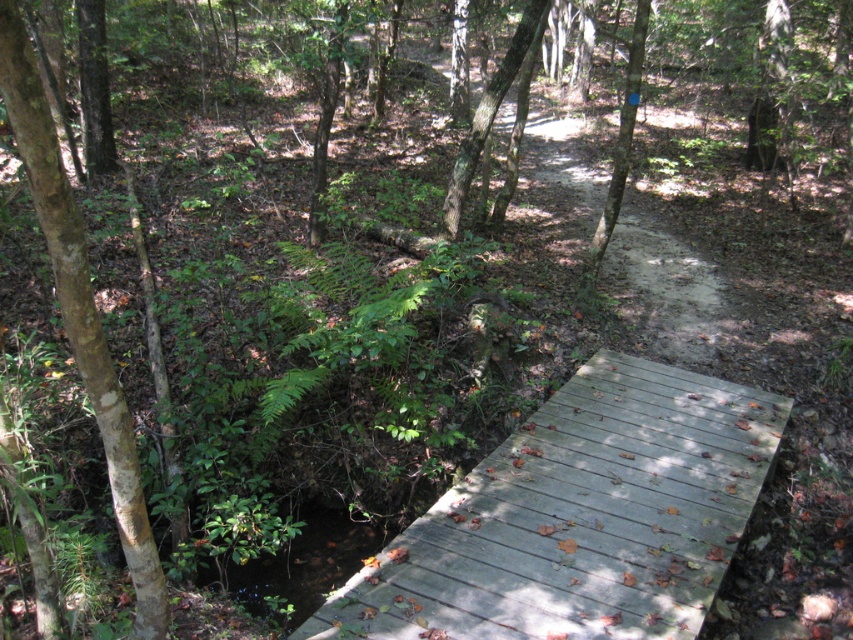
Question: Which of the following is the closest to the observer?

Choices:
 (A) (303, 625)
 (B) (106, 353)
 (C) (630, 116)
 (D) (454, 179)

Answer: (B)

Question: Is smooth brown tree trunk at center to the right of smooth bark tree at upper center from the viewer's perspective?

Choices:
 (A) no
 (B) yes

Answer: (A)

Question: Can you confirm if wooden bridge at center is positioned below brown/scaly tree trunk at left?

Choices:
 (A) yes
 (B) no

Answer: (A)

Question: Is the position of wooden bridge at center more distant than that of brown/scaly tree trunk at left?

Choices:
 (A) yes
 (B) no

Answer: (A)

Question: Among these objects, which one is farthest from the camera?

Choices:
 (A) smooth brown tree trunk at center
 (B) wooden bridge at center
 (C) brown/scaly tree trunk at left

Answer: (A)

Question: Among these objects, which one is farthest from the camera?

Choices:
 (A) smooth brown tree trunk at center
 (B) brown/scaly tree trunk at left

Answer: (A)